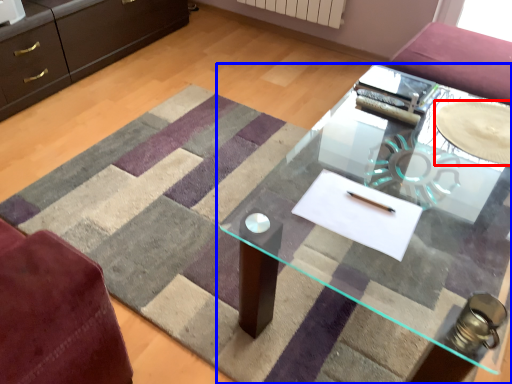
Question: Among these objects, which one is nearest to the camera, glass plate (highlighted by a red box) or table (highlighted by a blue box)?

Choices:
 (A) glass plate
 (B) table

Answer: (B)